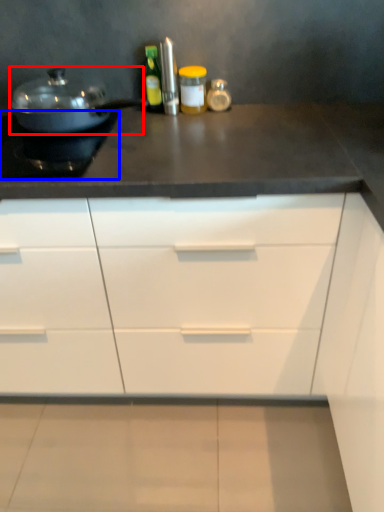
Question: Among these objects, which one is farthest to the camera, kitchen appliance (highlighted by a red box) or appliance (highlighted by a blue box)?

Choices:
 (A) kitchen appliance
 (B) appliance

Answer: (A)